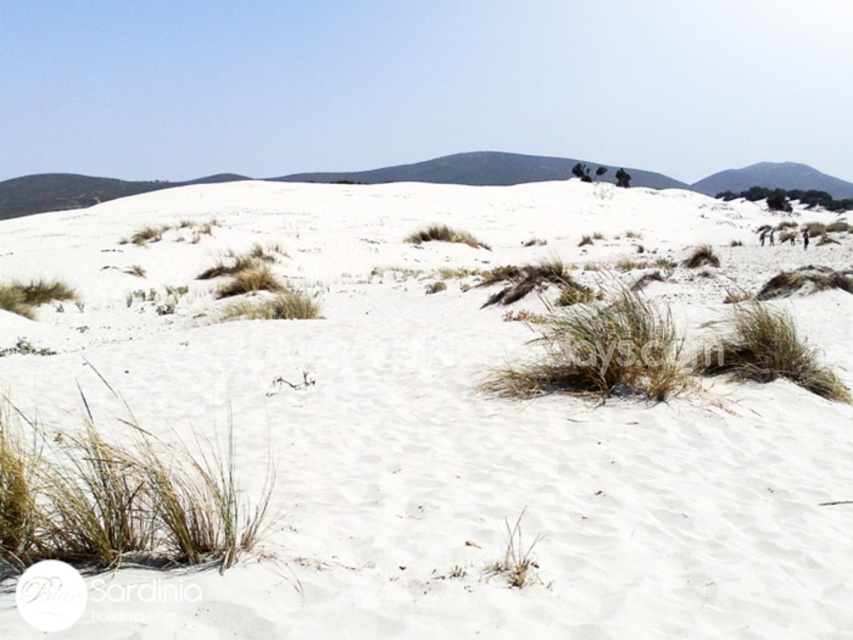
Who is positioned more to the right, white sand dune at center or green fibrous grass at lower right?

green fibrous grass at lower right

Between white sand dune at center and green fibrous grass at lower right, which one is positioned higher?

white sand dune at center is above.

Locate an element on the screen. This screenshot has width=853, height=640. white sand dune at center is located at coordinates [444, 417].

Find the location of a particular element. The image size is (853, 640). white sand dune at center is located at coordinates (444, 417).

Can you confirm if green fibrous grass at lower right is positioned to the right of green grassy hill at upper right?

No, green fibrous grass at lower right is not to the right of green grassy hill at upper right.

Who is more forward, (720, 365) or (732, 177)?

Positioned in front is point (720, 365).

Which is in front, point (782, 342) or point (796, 177)?

Point (782, 342)

You are a GUI agent. You are given a task and a screenshot of the screen. Output one action in this format:
    pyautogui.click(x=<x>, y=<y>)
    Task: Click on the green fibrous grass at lower right
    
    Given the screenshot: What is the action you would take?
    pyautogui.click(x=767, y=352)

Is point (741, 541) behind point (181, 458)?

No, (741, 541) is closer to viewer.

Find the location of a particular element. white sand dune at center is located at coordinates (444, 417).